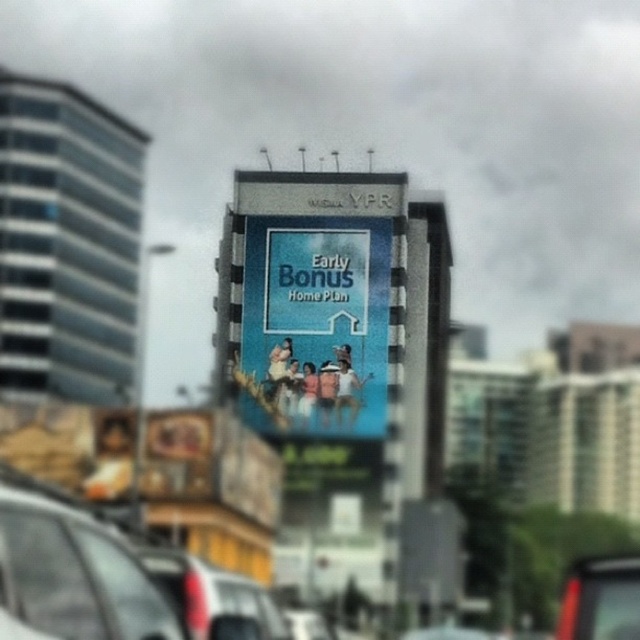
You are driving a car that is 5 meters long. You are currently positioned at the matte black car at lower left and want to park your car directly in front of the blue glossy billboard at center. Is there enough space between the billboard and the road to park your car?

The distance between the blue glossy billboard at center and the matte black car at lower left is 75.75 meters. Since your car is only 5 meters long, there is ample space to park your car directly in front of the billboard as the distance is significantly larger than the car length.

You are driving a car that is 4.5 meters long and need to park between the matte gray car at lower left and the matte black car at lower left. Can you fit your car in the space between them?

The distance between the matte gray car at lower left and the matte black car at lower left is 9.60 meters. Since your car is 4.5 meters long, there is enough space to park between them.

You are a passenger in a car and looking out the window. You see two cars, a matte gray car at lower left and a matte black car at lower left. Which car is closer to you?

The matte gray car at lower left is closer to you because it is located above the matte black car at lower left, indicating it is nearer in the line of sight.